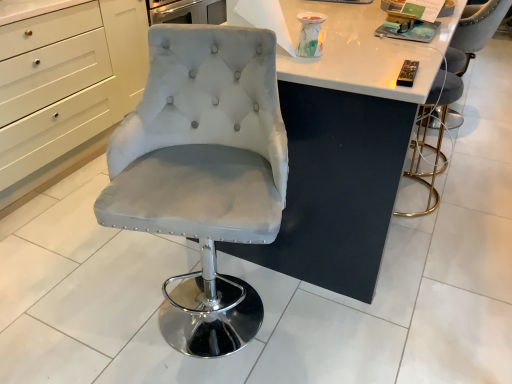
This screenshot has width=512, height=384. Find the location of `free space in front of metallic gold bar stool at right, the 2th chair viewed from the right`. free space in front of metallic gold bar stool at right, the 2th chair viewed from the right is located at coordinates (441, 240).